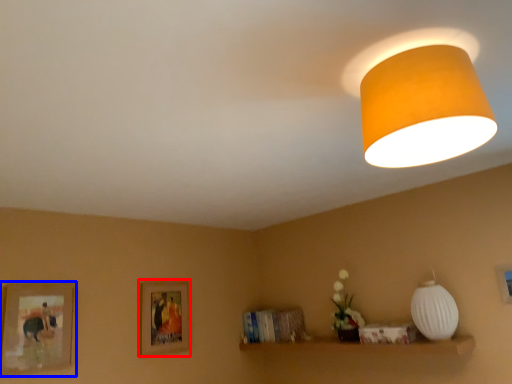
Question: Which object is further to the camera taking this photo, picture frame (highlighted by a red box) or picture frame (highlighted by a blue box)?

Choices:
 (A) picture frame
 (B) picture frame

Answer: (A)